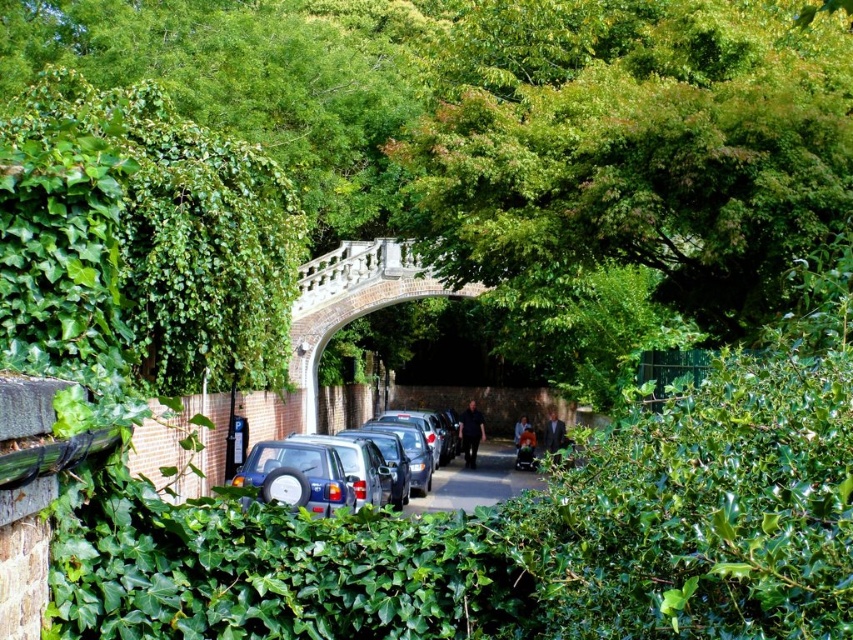
Which is more to the right, satin silver car at center or metallic gray car at center?

metallic gray car at center

Is satin silver car at center to the left of metallic gray car at center from the viewer's perspective?

Correct, you'll find satin silver car at center to the left of metallic gray car at center.

Which is in front, point (395, 456) or point (494, 460)?

Point (395, 456)

Where is `satin silver car at center`? satin silver car at center is located at coordinates (345, 461).